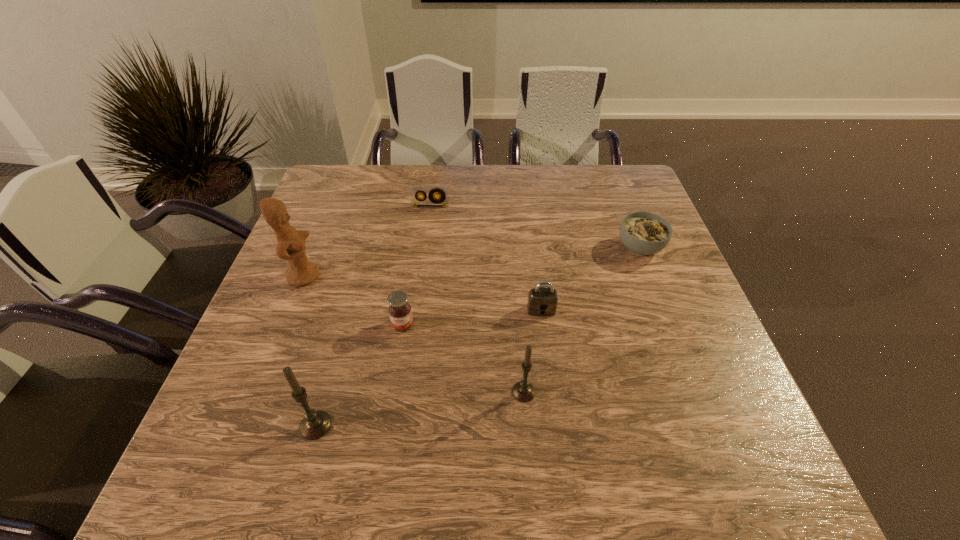
Where is `vacant space that satisfies the following two spatial constraints: 1. on the label side of the third tallest object; 2. on the left side of the jam`? The width and height of the screenshot is (960, 540). vacant space that satisfies the following two spatial constraints: 1. on the label side of the third tallest object; 2. on the left side of the jam is located at coordinates (393, 392).